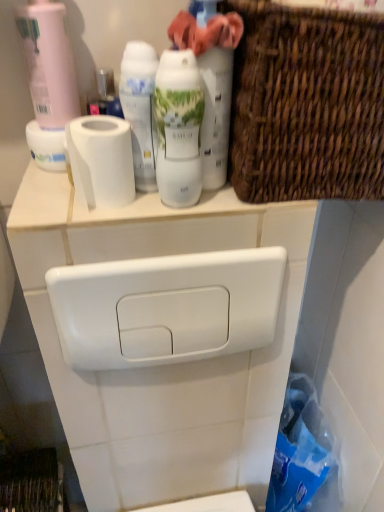
Question: Is matte white spray can at upper center, placed as the second cleaning product when sorted from left to right, outside woven brown basket at upper right?

Choices:
 (A) yes
 (B) no

Answer: (A)

Question: Considering the relative positions of matte white spray can at upper center, placed as the second cleaning product when sorted from left to right, and woven brown basket at upper right in the image provided, is matte white spray can at upper center, placed as the second cleaning product when sorted from left to right, to the left of woven brown basket at upper right from the viewer's perspective?

Choices:
 (A) no
 (B) yes

Answer: (B)

Question: From a real-world perspective, is matte white spray can at upper center, which is counted as the 1th cleaning product, starting from the right, physically below woven brown basket at upper right?

Choices:
 (A) yes
 (B) no

Answer: (B)

Question: Is matte white spray can at upper center, placed as the second cleaning product when sorted from left to right, further to camera compared to woven brown basket at upper right?

Choices:
 (A) no
 (B) yes

Answer: (B)

Question: Does matte white spray can at upper center, which is counted as the 1th cleaning product, starting from the right, lie in front of woven brown basket at upper right?

Choices:
 (A) yes
 (B) no

Answer: (B)

Question: Is point (188, 177) closer or farther from the camera than point (297, 54)?

Choices:
 (A) closer
 (B) farther

Answer: (B)

Question: From the image's perspective, is matte white shaving cream at center, acting as the first shaving cream starting from the right, positioned above or below woven brown basket at upper right?

Choices:
 (A) below
 (B) above

Answer: (A)

Question: Is matte white shaving cream at center, acting as the first shaving cream starting from the right, wider or thinner than woven brown basket at upper right?

Choices:
 (A) wide
 (B) thin

Answer: (B)

Question: Relative to woven brown basket at upper right, is matte white shaving cream at center, arranged as the second shaving cream when viewed from the left, in front or behind?

Choices:
 (A) behind
 (B) front

Answer: (A)

Question: Visually, is white glossy toilet tank at upper center positioned to the left or to the right of white glossy shaving cream at center, which appears as the 1th shaving cream when viewed from the left?

Choices:
 (A) right
 (B) left

Answer: (A)

Question: From a real-world perspective, is white glossy toilet tank at upper center physically located above or below white glossy shaving cream at center, arranged as the 2th shaving cream when viewed from the right?

Choices:
 (A) above
 (B) below

Answer: (B)

Question: From the image's perspective, relative to white glossy shaving cream at center, arranged as the 2th shaving cream when viewed from the right, is white glossy toilet tank at upper center above or below?

Choices:
 (A) above
 (B) below

Answer: (B)

Question: Considering the positions of white glossy toilet tank at upper center and white glossy shaving cream at center, which appears as the 1th shaving cream when viewed from the left, in the image, is white glossy toilet tank at upper center bigger or smaller than white glossy shaving cream at center, which appears as the 1th shaving cream when viewed from the left,?

Choices:
 (A) small
 (B) big

Answer: (B)

Question: From their relative heights in the image, would you say pink matte bottle at upper left, the 2th cleaning product positioned from the right, is taller or shorter than white matte toilet paper at upper left?

Choices:
 (A) tall
 (B) short

Answer: (A)

Question: Considering the positions of point (21, 28) and point (117, 141), is point (21, 28) closer or farther from the camera than point (117, 141)?

Choices:
 (A) closer
 (B) farther

Answer: (B)